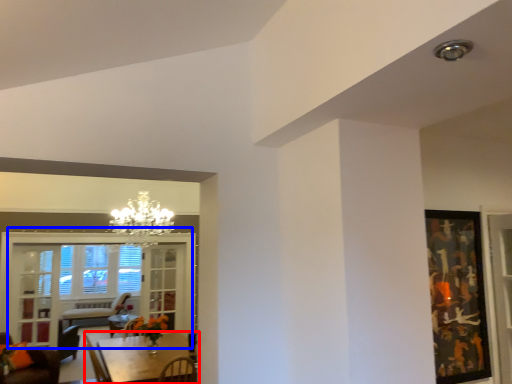
Question: Which of the following is the farthest to the observer, table (highlighted by a red box) or window (highlighted by a blue box)?

Choices:
 (A) table
 (B) window

Answer: (B)